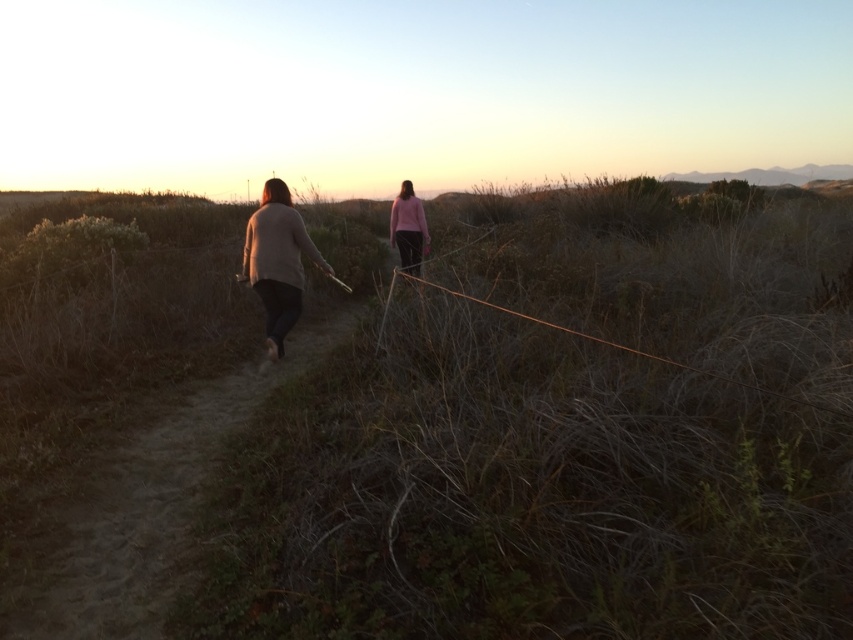
Question: Which is farther from the pink matte sweater at center?

Choices:
 (A) brown dry grass at center
 (B) dirt path at center
 (C) light beige sweater at center

Answer: (B)

Question: Which of the following is the farthest from the observer?

Choices:
 (A) (407, 193)
 (B) (148, 538)
 (C) (71, 544)
 (D) (253, 285)

Answer: (A)

Question: Is brown dry grass at center to the left of pink matte sweater at center from the viewer's perspective?

Choices:
 (A) no
 (B) yes

Answer: (A)

Question: Considering the real-world distances, which object is farthest from the brown dry grass at center?

Choices:
 (A) dirt path at center
 (B) light beige sweater at center
 (C) pink matte sweater at center

Answer: (A)

Question: Is the position of light beige sweater at center less distant than that of pink matte sweater at center?

Choices:
 (A) no
 (B) yes

Answer: (B)

Question: Does dirt path at center lie in front of light beige sweater at center?

Choices:
 (A) yes
 (B) no

Answer: (A)